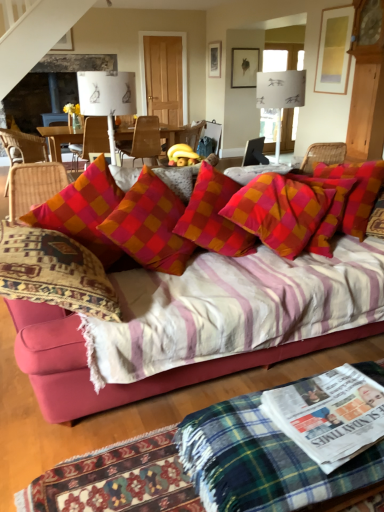
Question: Is white glossy newspaper at lower right bigger or smaller than green plaid blanket at lower center?

Choices:
 (A) small
 (B) big

Answer: (A)

Question: Is white glossy newspaper at lower right wider or thinner than green plaid blanket at lower center?

Choices:
 (A) thin
 (B) wide

Answer: (A)

Question: Estimate the real-world distances between objects in this image. Which object is farther from the white glossy newspaper at lower right?

Choices:
 (A) checkered fabric pillow at center, placed as the first pillow when sorted from left to right
 (B) wooden chair at center, positioned as the 3th chair in right-to-left order
 (C) woven wicker chair at left, arranged as the first chair when viewed from the left
 (D) plush pink couch at center
 (E) wooden chair at center, the 4th chair in the left-to-right sequence

Answer: (C)

Question: Which object is positioned closest to the green plaid blanket at lower center?

Choices:
 (A) plaid fabric pillow at center, the 2th pillow positioned from the left
 (B) white paper lampshade at upper center, placed as the first lamp when sorted from left to right
 (C) white paper lampshade at upper center, which ranks as the first lamp in right-to-left order
 (D) woven wicker chair at left, the 4th chair positioned from the right
 (E) wooden chair at center, the 1th chair viewed from the right

Answer: (A)